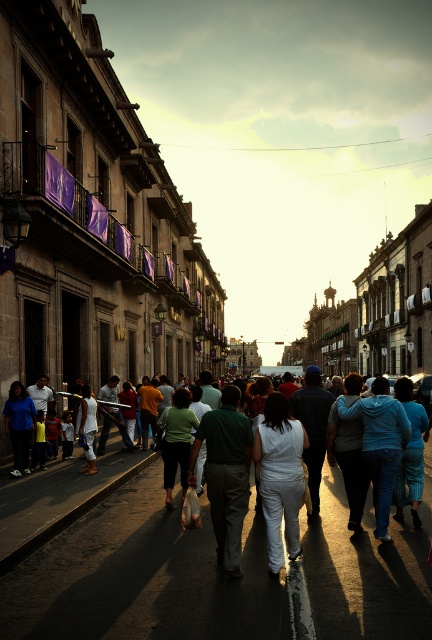
Question: Is white cotton crowd at center positioned at the back of white matte pants at center?

Choices:
 (A) no
 (B) yes

Answer: (B)

Question: Does white cotton crowd at center appear under white matte pants at center?

Choices:
 (A) no
 (B) yes

Answer: (B)

Question: Is white cotton crowd at center below white matte pants at center?

Choices:
 (A) yes
 (B) no

Answer: (A)

Question: Which of the following is the closest to the observer?

Choices:
 (A) white matte pants at center
 (B) white cotton crowd at center

Answer: (A)

Question: Which point is closer to the camera?

Choices:
 (A) white matte pants at center
 (B) white cotton crowd at center

Answer: (A)